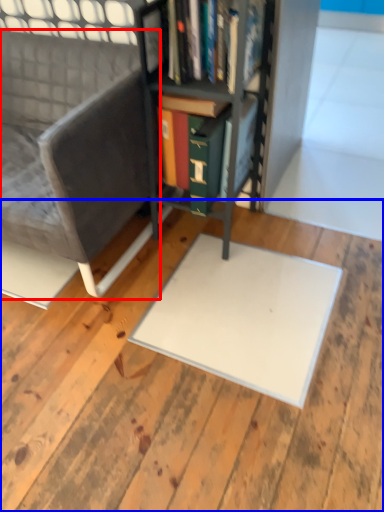
Question: Which point is closer to the camera, chair (highlighted by a red box) or plywood (highlighted by a blue box)?

Choices:
 (A) chair
 (B) plywood

Answer: (B)